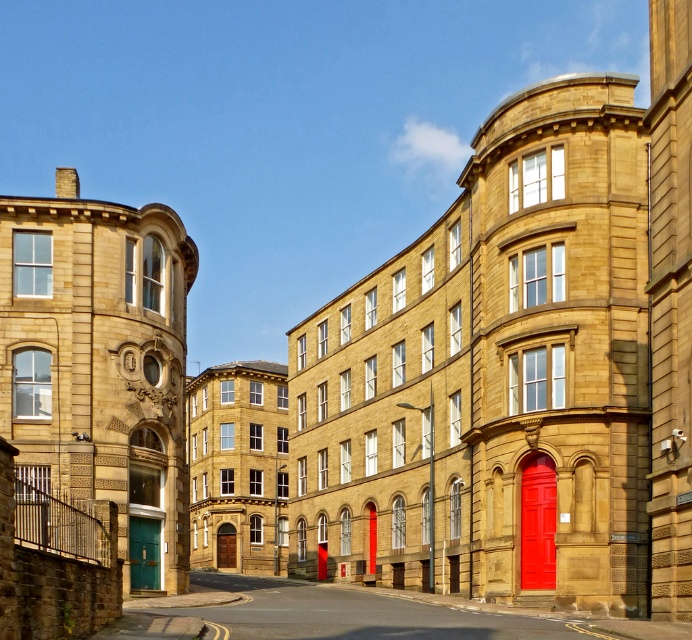
Measure the distance from matte red door at center to green matte door at lower left.

A distance of 19.23 meters exists between matte red door at center and green matte door at lower left.

Is matte red door at center below green matte door at lower left?

Incorrect, matte red door at center is not positioned below green matte door at lower left.

Is point (527, 544) in front of point (136, 572)?

No, it is not.

Find the location of a particular element. matte red door at center is located at coordinates (537, 524).